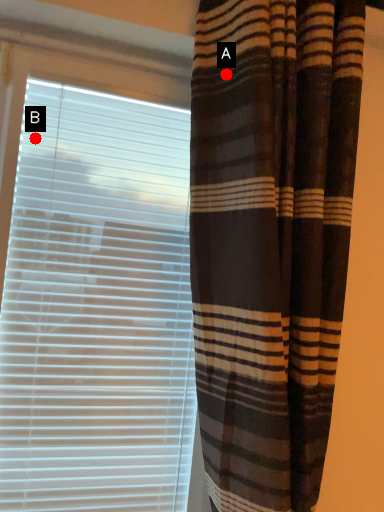
Question: Two points are circled on the image, labeled by A and B beside each circle. Which point appears closest to the camera in this image?

Choices:
 (A) A is closer
 (B) B is closer

Answer: (A)